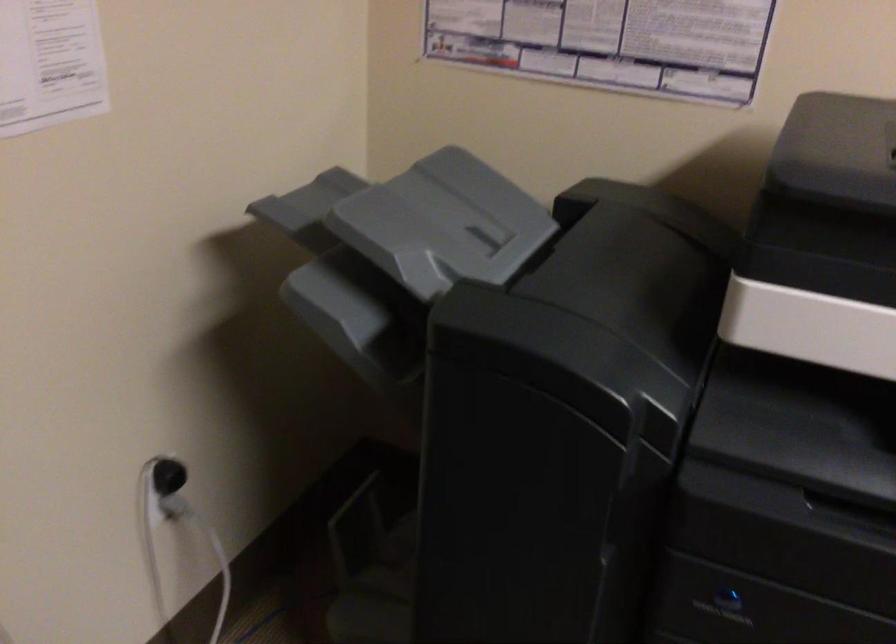
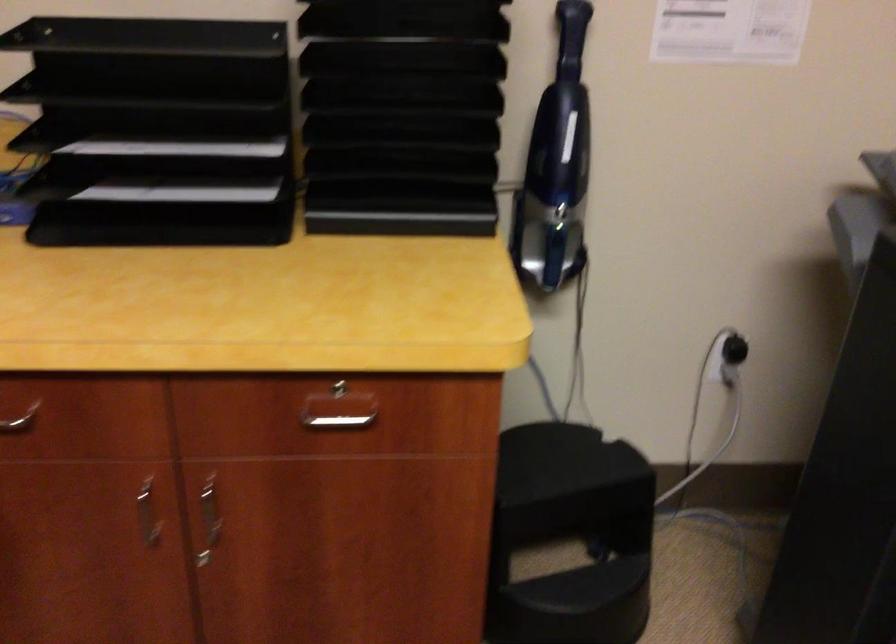
Question: The first image is from the beginning of the video and the second image is from the end. How did the camera likely rotate when shooting the video?

Choices:
 (A) Left
 (B) Right
 (C) Up
 (D) Down

Answer: (A)